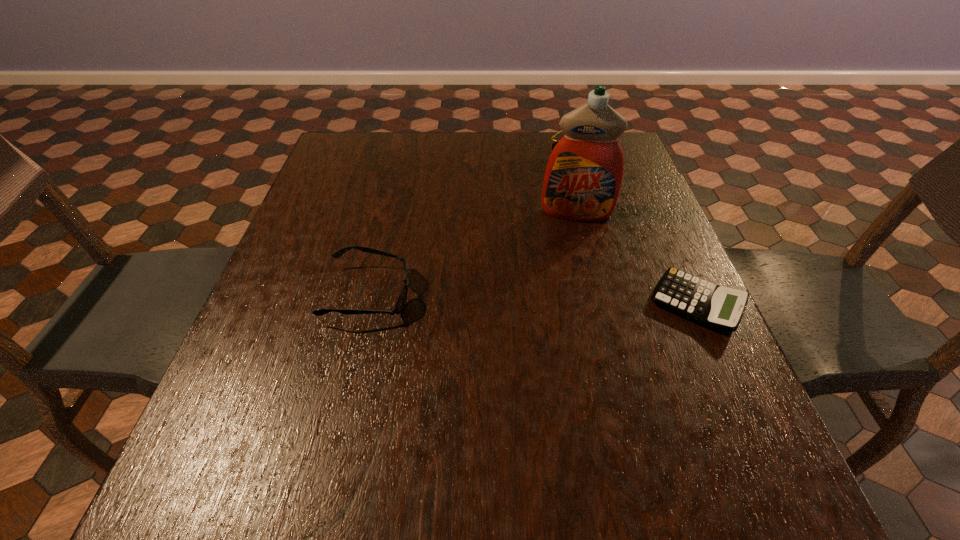
Image resolution: width=960 pixels, height=540 pixels. In order to click on object at the far right corner in this screenshot , I will do `click(553, 145)`.

Identify the location of vacant area at the far edge. The width and height of the screenshot is (960, 540). (423, 147).

Identify the location of vacant space at the near edge of the desktop. (514, 428).

The width and height of the screenshot is (960, 540). I want to click on free spot at the left edge of the desktop, so click(363, 206).

In the image, there is a desktop. Where is `vacant space at the right edge`? vacant space at the right edge is located at coordinates (660, 234).

In the image, there is a desktop. At what (x,y) coordinates should I click in order to perform the action: click on vacant space at the near left corner. Please return your answer as a coordinate pair (x, y). This screenshot has width=960, height=540. Looking at the image, I should click on (237, 429).

Identify the location of vacant space at the near right corner. (659, 408).

The height and width of the screenshot is (540, 960). I want to click on blank region between the shortest object and the nearer sunglasses, so click(533, 299).

You are a GUI agent. You are given a task and a screenshot of the screen. Output one action in this format:
    pyautogui.click(x=<x>, y=<y>)
    Task: Click on the vacant space that is in between the farthest object and the left sunglasses
    The width and height of the screenshot is (960, 540).
    Given the screenshot: What is the action you would take?
    pyautogui.click(x=475, y=222)

In order to click on free space that is in between the left sunglasses and the farthest object in this screenshot , I will do `click(475, 222)`.